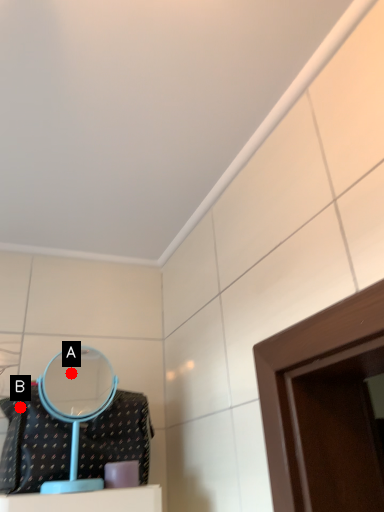
Question: Two points are circled on the image, labeled by A and B beside each circle. Which point is closer to the camera?

Choices:
 (A) A is closer
 (B) B is closer

Answer: (B)